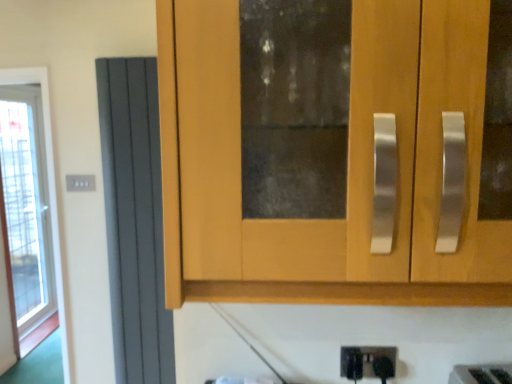
Question: Can you confirm if matte gray radiator at left is smaller than white plastic electric outlet at upper left?

Choices:
 (A) no
 (B) yes

Answer: (A)

Question: Does matte gray radiator at left have a lesser height compared to white plastic electric outlet at upper left?

Choices:
 (A) yes
 (B) no

Answer: (B)

Question: Can you confirm if matte gray radiator at left is bigger than white plastic electric outlet at upper left?

Choices:
 (A) no
 (B) yes

Answer: (B)

Question: Is matte gray radiator at left turned away from white plastic electric outlet at upper left?

Choices:
 (A) no
 (B) yes

Answer: (A)

Question: Can white plastic electric outlet at upper left be found inside matte gray radiator at left?

Choices:
 (A) no
 (B) yes

Answer: (A)

Question: From the image's perspective, is matte gray radiator at left over white plastic electric outlet at upper left?

Choices:
 (A) yes
 (B) no

Answer: (B)

Question: Does white plastic electric outlet at upper left appear on the right side of matte gray radiator at left?

Choices:
 (A) yes
 (B) no

Answer: (B)

Question: Does white plastic electric outlet at upper left lie behind matte gray radiator at left?

Choices:
 (A) yes
 (B) no

Answer: (A)

Question: From the image's perspective, is white plastic electric outlet at upper left under matte gray radiator at left?

Choices:
 (A) no
 (B) yes

Answer: (A)

Question: Considering the relative sizes of white plastic electric outlet at upper left and matte gray radiator at left in the image provided, is white plastic electric outlet at upper left shorter than matte gray radiator at left?

Choices:
 (A) yes
 (B) no

Answer: (A)

Question: Is white plastic electric outlet at upper left oriented away from matte gray radiator at left?

Choices:
 (A) yes
 (B) no

Answer: (B)

Question: Is white plastic electric outlet at upper left aimed at matte gray radiator at left?

Choices:
 (A) yes
 (B) no

Answer: (B)

Question: Looking at their shapes, would you say matte gray radiator at left is wider or thinner than white plastic electric outlet at upper left?

Choices:
 (A) wide
 (B) thin

Answer: (A)